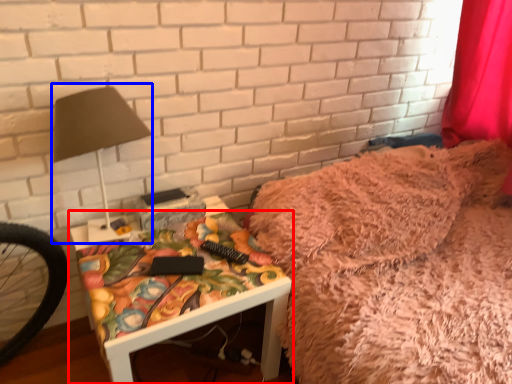
Question: Which object is closer to the camera taking this photo, furniture (highlighted by a red box) or table lamp (highlighted by a blue box)?

Choices:
 (A) furniture
 (B) table lamp

Answer: (B)